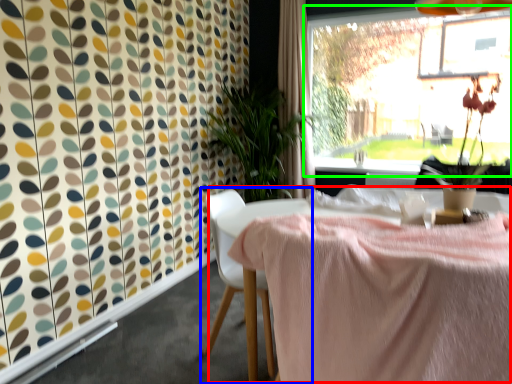
Question: Which is farther away from table (highlighted by a red box)? chair (highlighted by a blue box) or window (highlighted by a green box)?

Choices:
 (A) chair
 (B) window

Answer: (B)